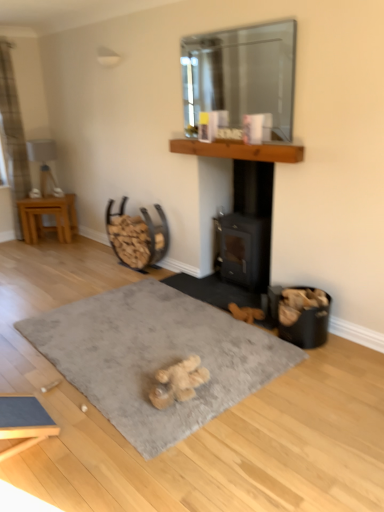
Identify the location of free point above gray soft rug at center (from a real-world perspective). (142, 334).